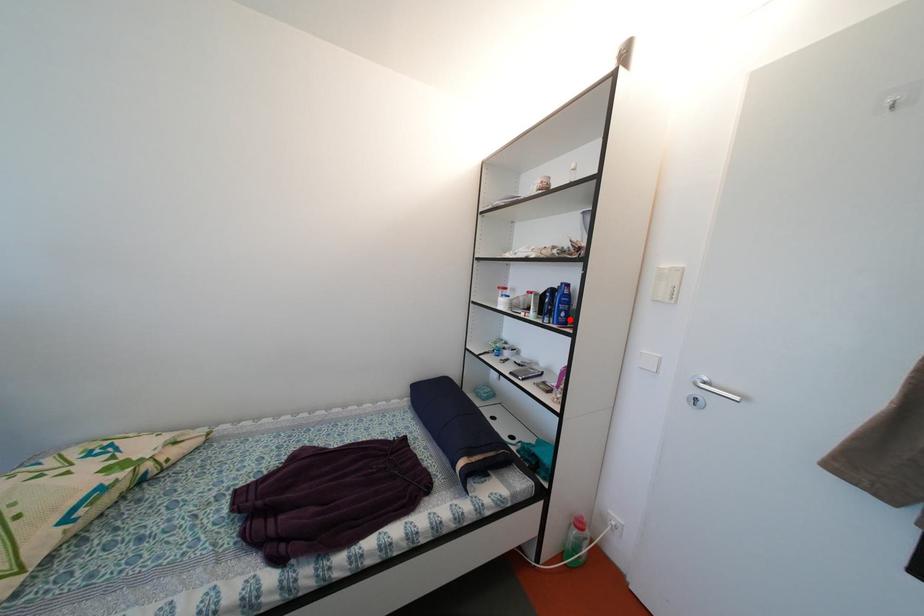
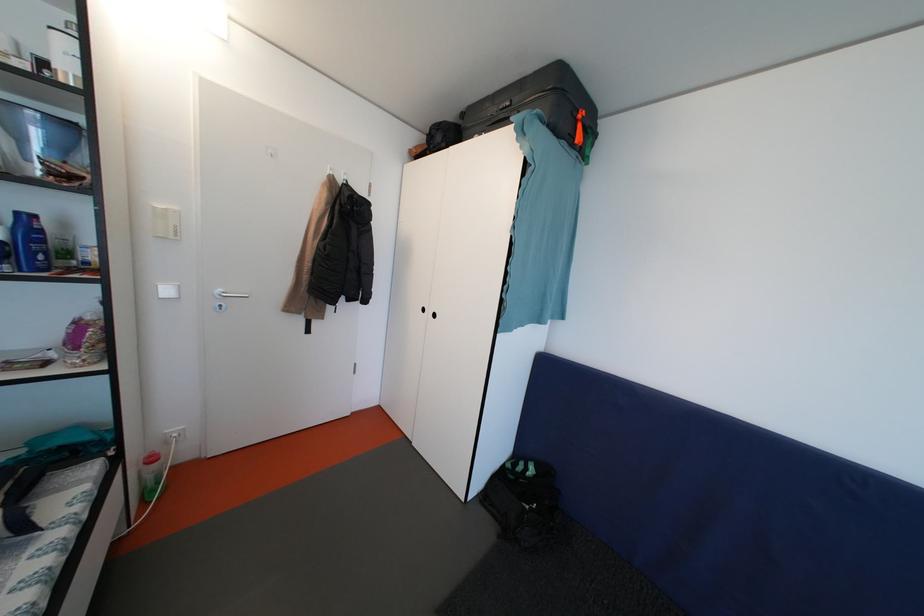
The point at the highlighted location is marked in the first image. Where is the corresponding point in the second image?

(49, 262)